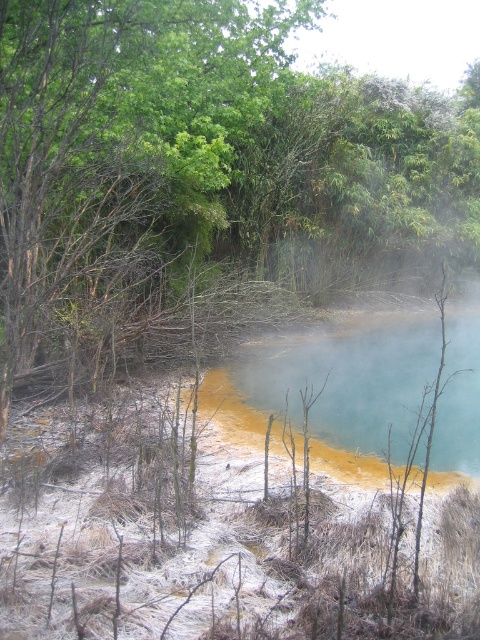
You are standing at the point labeled as point (200, 163) in the image. What do you see directly in front of you?

You see a green leafy tree at upper center directly in front of you at point (200, 163).